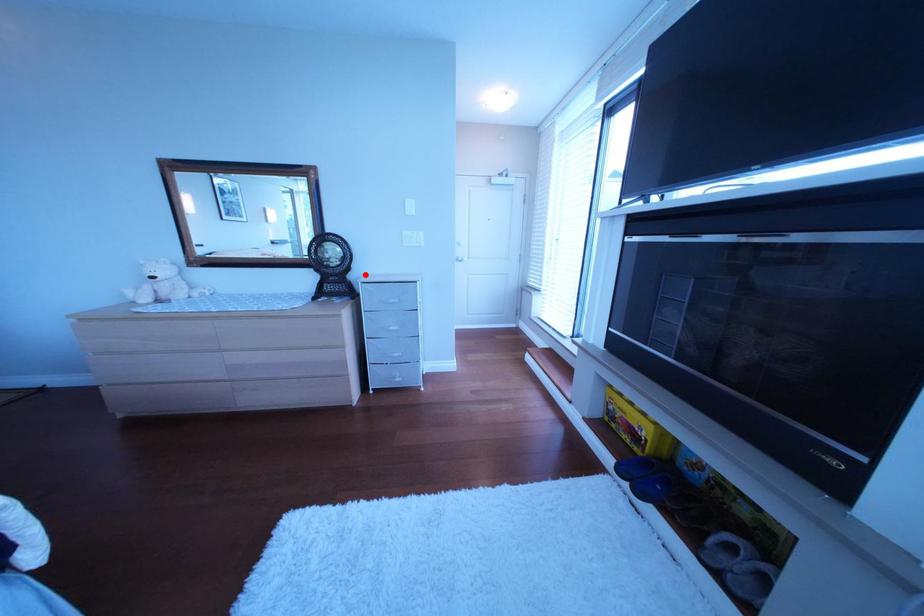
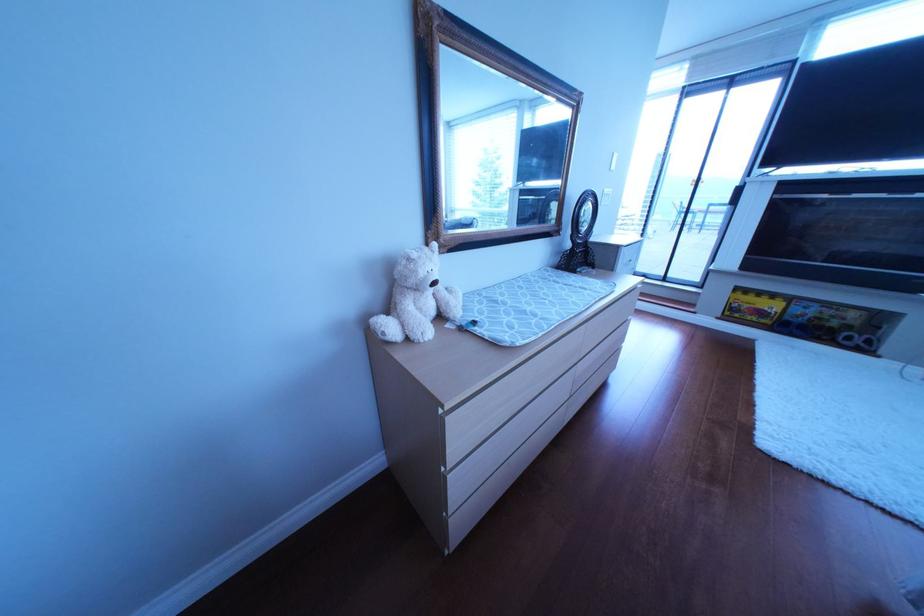
Question: I am providing you with two images of the same scene from different viewpoints. A red point is marked on the first image. Can you still see the location of the red point in image 2?

Choices:
 (A) Yes
 (B) No

Answer: (A)